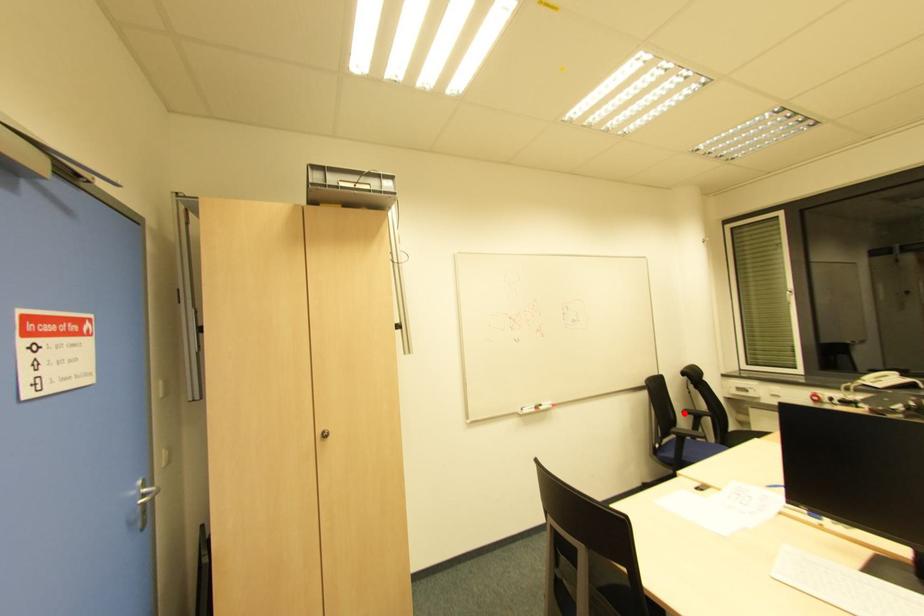
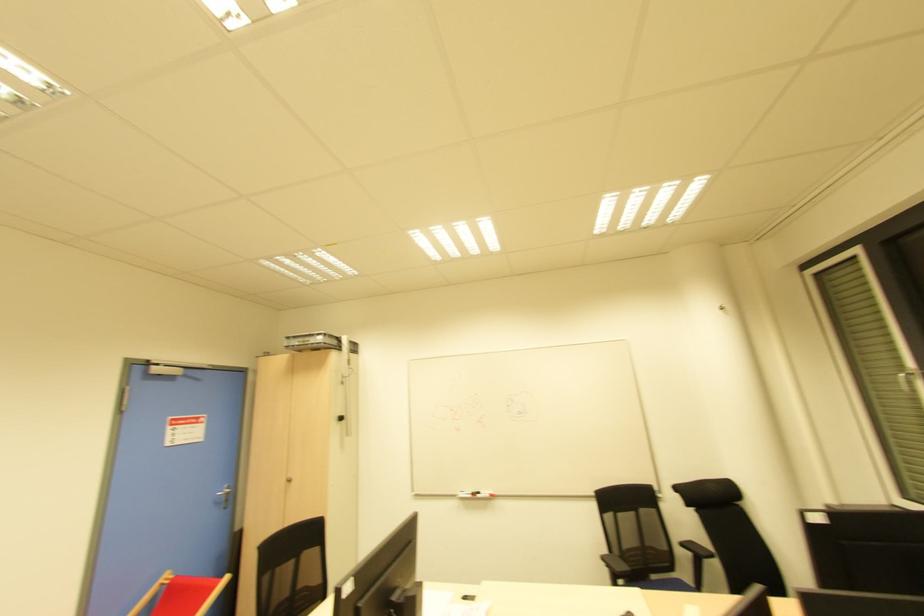
Question: I am providing you with two images of the same scene from different viewpoints. Image1 has a red point marked. In image2, the corresponding 3D location appears at what relative position? Reply with the corresponding letter.

Choices:
 (A) Closer
 (B) Farther

Answer: (A)